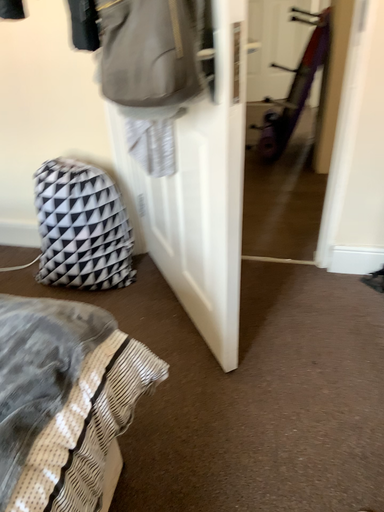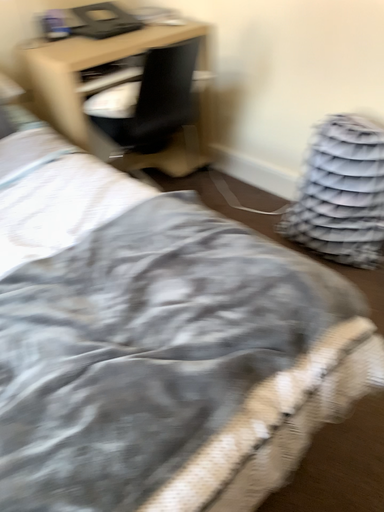
Question: How did the camera likely rotate when shooting the video?

Choices:
 (A) rotated left
 (B) rotated right

Answer: (A)